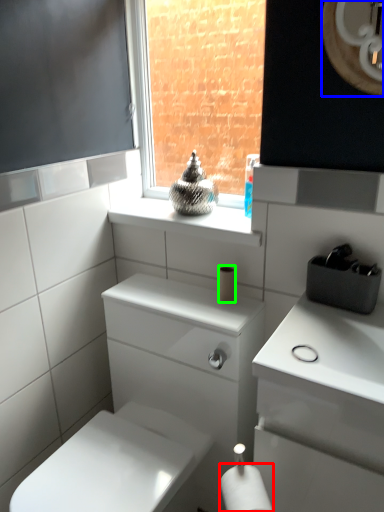
Question: Estimate the real-world distances between objects in this image. Which object is closer to toilet paper (highlighted by a red box), mirror (highlighted by a blue box) or toilet paper (highlighted by a green box)?

Choices:
 (A) mirror
 (B) toilet paper

Answer: (B)